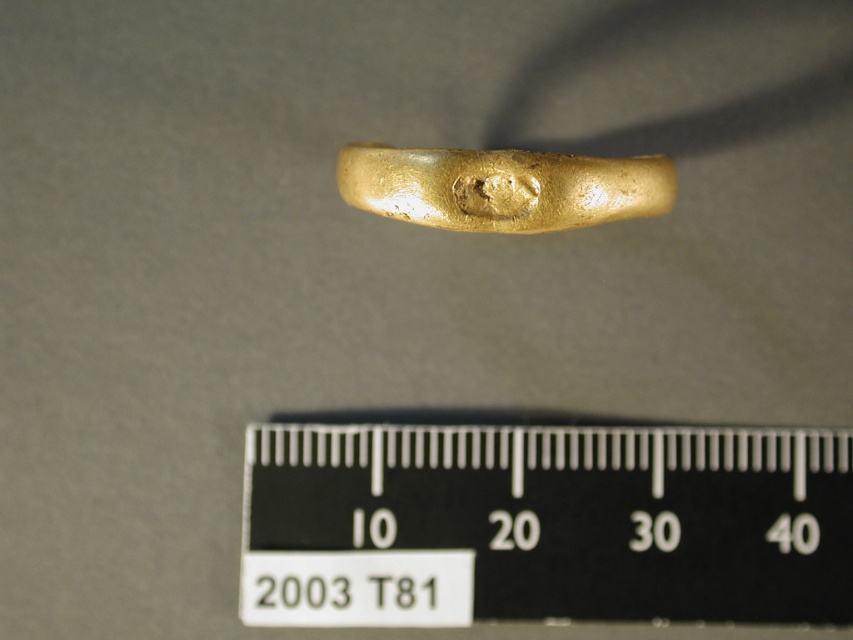
You are a photographer trying to capture a detailed image of the black plastic ruler at center. You need to ensure that the ruler is in focus and fills the frame. Based on the scene description, what is the recommended distance you should maintain between your camera and the ruler?

The recommended distance to maintain between your camera and the black plastic ruler at center is 1.36 meters, as this is the distance specified between the ruler and the camera in the scene description.

You are an archaeologist examining the image of the shiny gold ring at center and the black plastic ruler at center. Based on their positions, which object is closer to the left edge of the image?

The shiny gold ring at center is closer to the left edge of the image because the black plastic ruler at center is to the right of it.